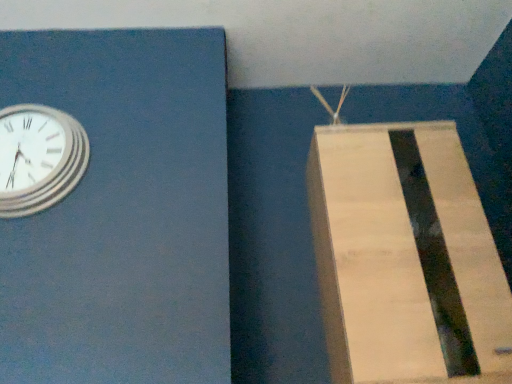
Question: Is silver metallic clock at upper left in front of or behind light brown cardboard at right in the image?

Choices:
 (A) behind
 (B) front

Answer: (A)

Question: Based on their positions, is silver metallic clock at upper left located to the left or right of light brown cardboard at right?

Choices:
 (A) right
 (B) left

Answer: (B)

Question: Is point (66, 122) closer or farther from the camera than point (490, 251)?

Choices:
 (A) closer
 (B) farther

Answer: (B)

Question: Based on their sizes in the image, would you say light brown cardboard at right is bigger or smaller than silver metallic clock at upper left?

Choices:
 (A) big
 (B) small

Answer: (A)

Question: From the image's perspective, is light brown cardboard at right above or below silver metallic clock at upper left?

Choices:
 (A) below
 (B) above

Answer: (A)

Question: Is light brown cardboard at right wider or thinner than silver metallic clock at upper left?

Choices:
 (A) wide
 (B) thin

Answer: (A)

Question: In the image, is light brown cardboard at right positioned in front of or behind silver metallic clock at upper left?

Choices:
 (A) front
 (B) behind

Answer: (A)